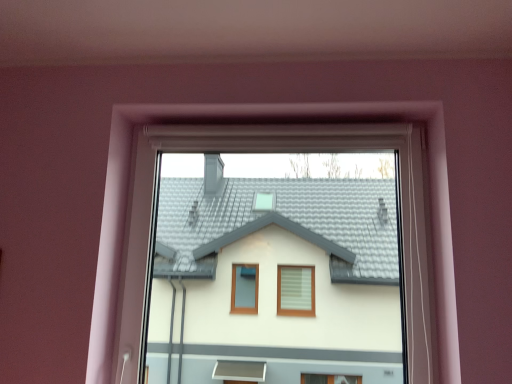
The image size is (512, 384). Describe the element at coordinates (250, 121) in the screenshot. I see `transparent glass window at center` at that location.

Measure the distance between transparent glass window at center and camera.

The distance of transparent glass window at center from camera is 1.29 meters.

Based on the photo, what is the approximate width of transparent glass window at center?

10.83 centimeters.

This screenshot has width=512, height=384. In order to click on transparent glass window at center in this screenshot , I will do `click(250, 121)`.

Where is `transparent glass window at center`? This screenshot has height=384, width=512. transparent glass window at center is located at coordinates (250, 121).